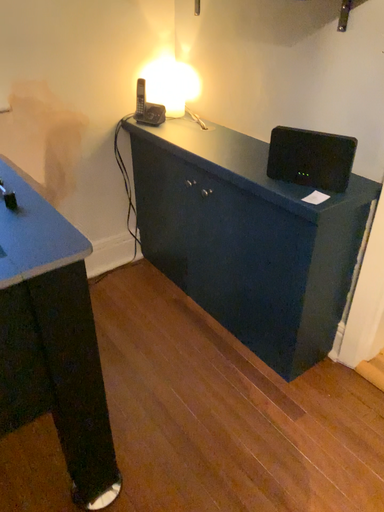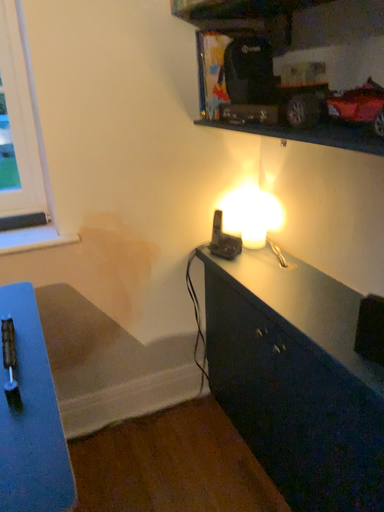
Question: How did the camera likely rotate when shooting the video?

Choices:
 (A) rotated right
 (B) rotated left

Answer: (B)